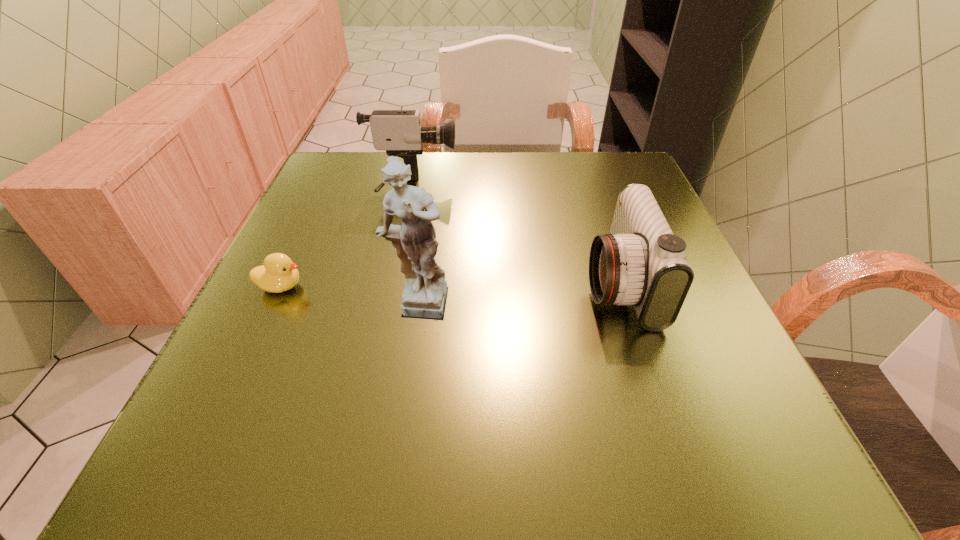
Identify which object is the third closest to the nearer camcorder. Please provide its 2D coordinates. Your answer should be formatted as a tuple, i.e. [(x, y)], where the tuple contains the x and y coordinates of a point satisfying the conditions above.

[(278, 274)]

Point out which object is positioned as the second nearest to the leftmost object. Please provide its 2D coordinates. Your answer should be formatted as a tuple, i.e. [(x, y)], where the tuple contains the x and y coordinates of a point satisfying the conditions above.

[(399, 132)]

Locate an element on the screen. vacant space that satisfies the following two spatial constraints: 1. on the surface of the rightmost object; 2. on the front-facing side of the figurine is located at coordinates (627, 307).